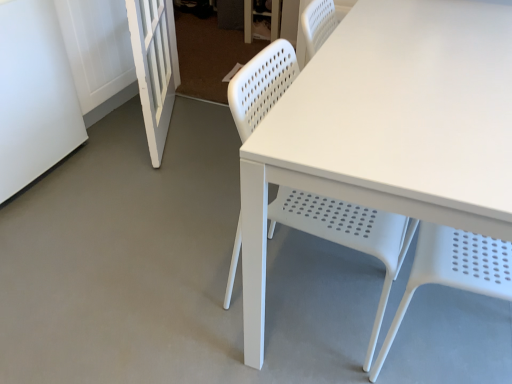
Find the location of a particular element. This screenshot has height=384, width=512. unoccupied region to the right of white matte screen door at left, positioned as the second screen door in left-to-right order is located at coordinates (206, 133).